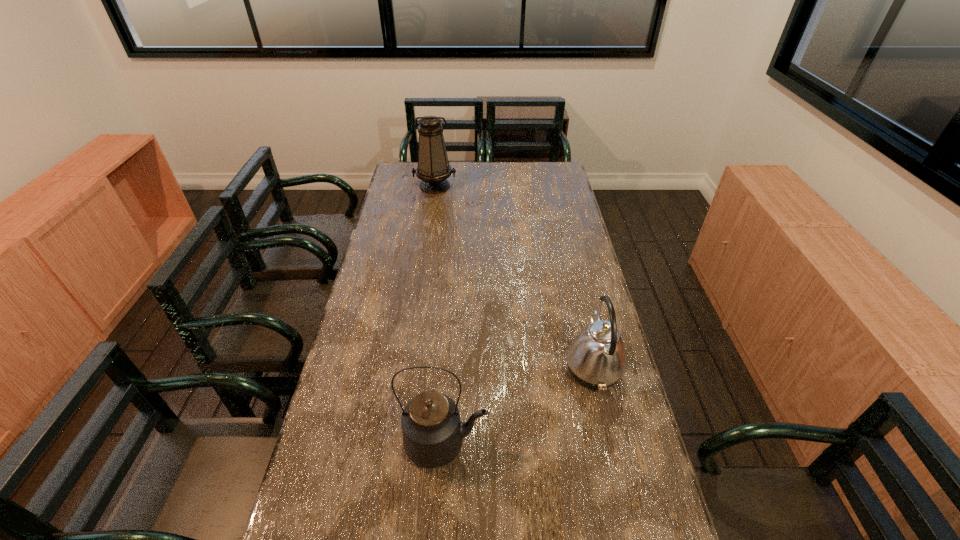
You are a GUI agent. You are given a task and a screenshot of the screen. Output one action in this format:
    pyautogui.click(x=<x>, y=<y>)
    Task: Click on the vacant area that lies between the left kettle and the farthest object
    
    Given the screenshot: What is the action you would take?
    pyautogui.click(x=440, y=315)

You are a GUI agent. You are given a task and a screenshot of the screen. Output one action in this format:
    pyautogui.click(x=<x>, y=<y>)
    Task: Click on the vacant space that's between the shorter kettle and the left kettle
    Image resolution: width=960 pixels, height=540 pixels.
    Given the screenshot: What is the action you would take?
    pyautogui.click(x=519, y=406)

You are a GUI agent. You are given a task and a screenshot of the screen. Output one action in this format:
    pyautogui.click(x=<x>, y=<y>)
    Task: Click on the free space that is in between the farthest object and the nearest object
    This screenshot has height=540, width=960.
    Given the screenshot: What is the action you would take?
    pyautogui.click(x=440, y=315)

In order to click on vacant space in between the oil lamp and the nearest object in this screenshot , I will do `click(440, 315)`.

I want to click on free spot between the nearest object and the rightmost object, so click(x=519, y=406).

Image resolution: width=960 pixels, height=540 pixels. I want to click on free area in between the shorter kettle and the nearest object, so click(519, 406).

Where is `free space between the farthest object and the right kettle`? The width and height of the screenshot is (960, 540). free space between the farthest object and the right kettle is located at coordinates (514, 277).

Identify which object is the second nearest to the right kettle. Please provide its 2D coordinates. Your answer should be formatted as a tuple, i.e. [(x, y)], where the tuple contains the x and y coordinates of a point satisfying the conditions above.

[(433, 169)]

Image resolution: width=960 pixels, height=540 pixels. What are the coordinates of `object that is the second closest to the shorter kettle` in the screenshot? It's located at (433, 169).